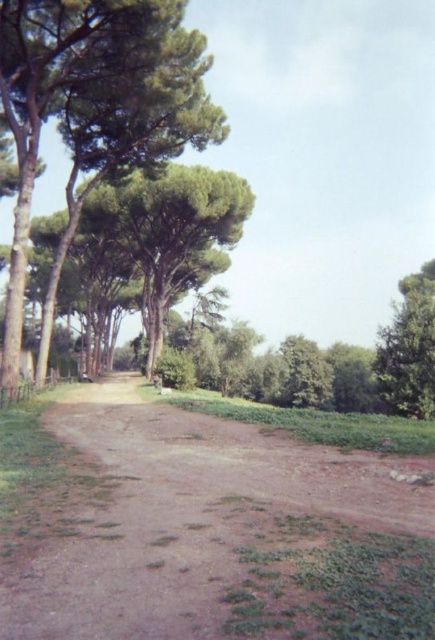
You are a hiker carrying a backpack and need to cross the brown dirt track at center. There is a green leafy tree at left nearby. Can you safely walk from the tree to the track without stepping into any water?

The distance between the brown dirt track at center and the green leafy tree at left is 11.95 meters. Since there is no mention of water in the scene description, you can safely walk from the tree to the track without stepping into water.

You are a hiker trying to determine which tree has a wider canopy between the green leafy tree at left and the green leafy tree at right. Based on the scene, which one has a wider canopy?

The green leafy tree at left has a wider canopy than the green leafy tree at right.

You are standing at the starting point of the pathway in this serene outdoor scene. You notice two points marked on the image, one at point (180, 106) and the other at point (410, 333). Which of these two points is closer to you as you stand at the pathway entrance?

Point (180, 106) is closer to the viewer than point (410, 333).